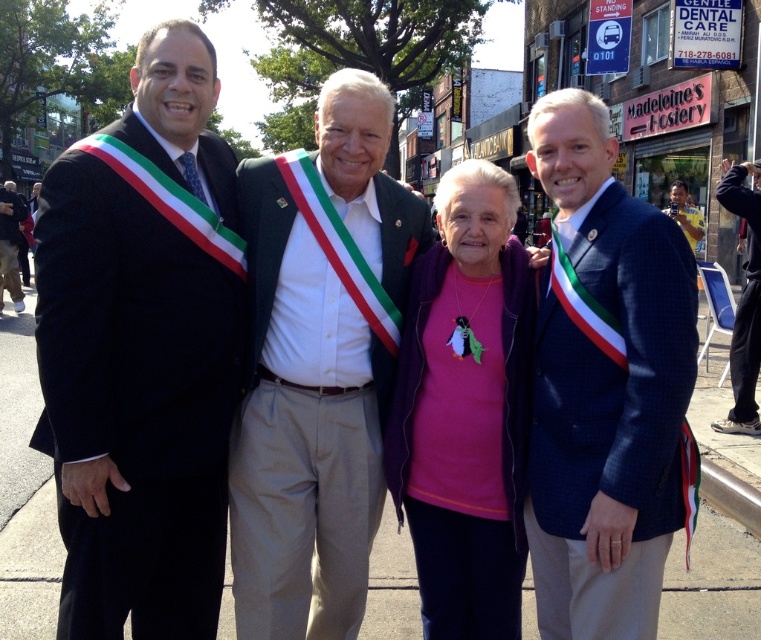
You are a photographer trying to capture a photo of the matte black suit at left and the black fabric pants at lower right. Which object is positioned lower in the image?

The matte black suit at left is located below black fabric pants at lower right, so the matte black suit at left is positioned lower in the image.

You are a photographer trying to capture a group photo of the white cotton shirt at center and the black fabric pants at lower right. Since you want to focus on the clothing items, which one should you zoom in on more to ensure it fills the frame appropriately?

The white cotton shirt at center has a larger width than the black fabric pants at lower right, so you should zoom in more on the white cotton shirt at center to ensure it fills the frame appropriately.